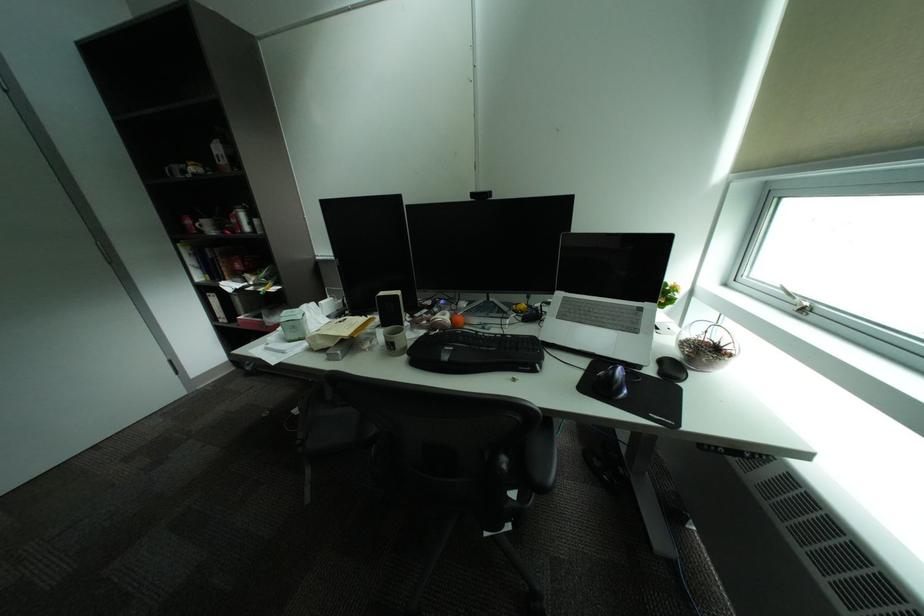
The location [611,383] corresponds to which object?

This point indicates the black computer mouse.